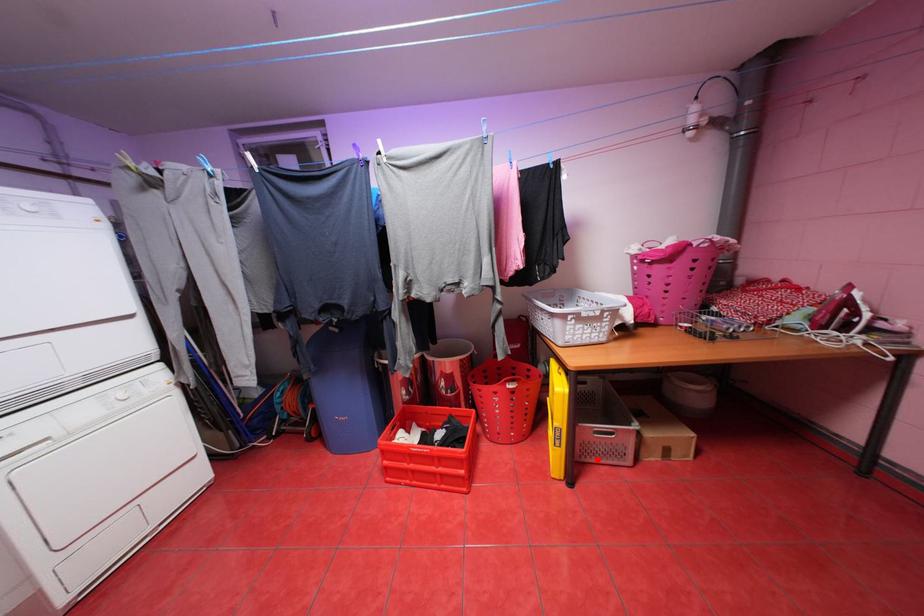
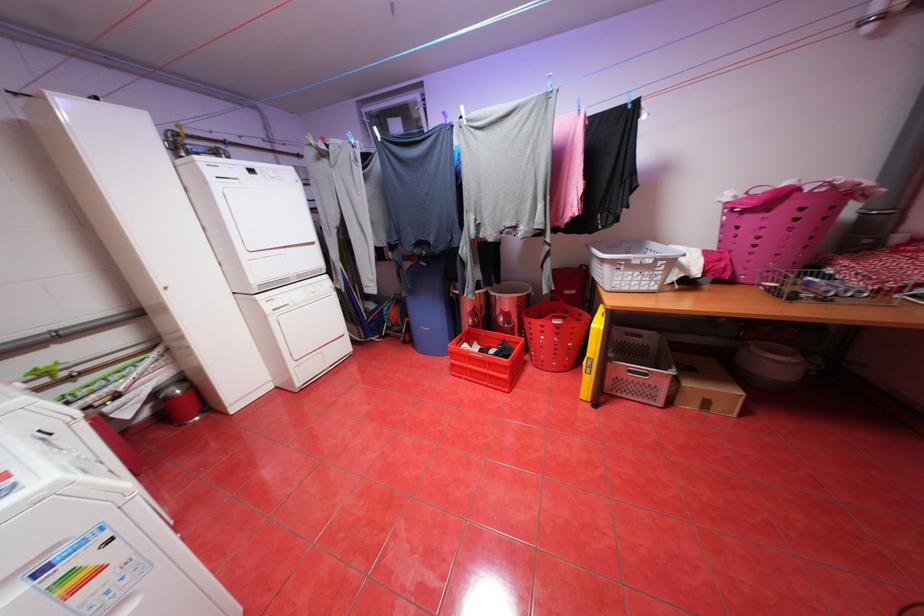
Find the pixel in the second image that matches the highlighted location in the first image.

(627, 394)